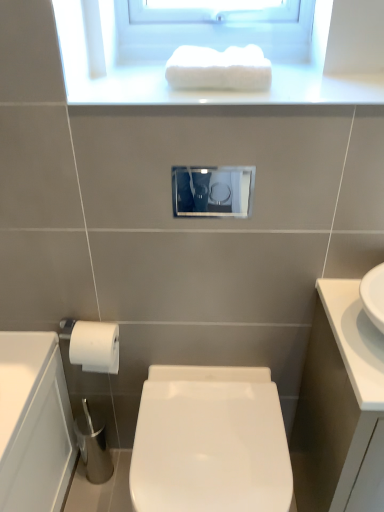
Question: Can you confirm if white glossy toilet at center is shorter than white glossy towel at upper center?

Choices:
 (A) yes
 (B) no

Answer: (B)

Question: From a real-world perspective, is white glossy toilet at center on white glossy towel at upper center?

Choices:
 (A) yes
 (B) no

Answer: (B)

Question: Is white glossy toilet at center bigger than white glossy towel at upper center?

Choices:
 (A) no
 (B) yes

Answer: (B)

Question: From a real-world perspective, does white glossy toilet at center sit lower than white glossy towel at upper center?

Choices:
 (A) yes
 (B) no

Answer: (A)

Question: Does white glossy toilet at center have a greater height compared to white glossy towel at upper center?

Choices:
 (A) no
 (B) yes

Answer: (B)

Question: Does white glossy toilet at center lie behind white glossy towel at upper center?

Choices:
 (A) no
 (B) yes

Answer: (B)

Question: Considering the relative sizes of white glossy towel at upper center and white glossy toilet at center in the image provided, is white glossy towel at upper center thinner than white glossy toilet at center?

Choices:
 (A) yes
 (B) no

Answer: (A)

Question: Is the depth of white glossy towel at upper center less than that of white glossy toilet at center?

Choices:
 (A) yes
 (B) no

Answer: (A)

Question: Would you say white glossy towel at upper center is outside white glossy toilet at center?

Choices:
 (A) yes
 (B) no

Answer: (A)

Question: Can you confirm if white glossy towel at upper center is wider than white glossy toilet at center?

Choices:
 (A) no
 (B) yes

Answer: (A)

Question: From the image's perspective, does white glossy towel at upper center appear lower than white glossy toilet at center?

Choices:
 (A) yes
 (B) no

Answer: (B)

Question: Could you tell me if white glossy towel at upper center is turned towards white glossy toilet at center?

Choices:
 (A) yes
 (B) no

Answer: (B)

Question: From the image's perspective, is white glossy cabinet at right located beneath white fluffy towel at upper center?

Choices:
 (A) yes
 (B) no

Answer: (A)